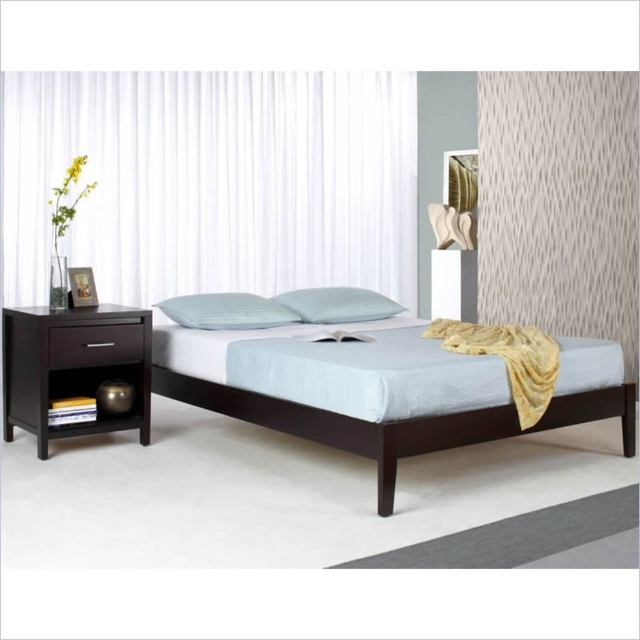
Question: Can you confirm if white sheer curtain at upper left is positioned to the left of light blue fabric pillow at center?

Choices:
 (A) yes
 (B) no

Answer: (A)

Question: Which of the following is the closest to the observer?

Choices:
 (A) (22, 83)
 (B) (52, 348)
 (C) (324, 292)
 (D) (29, 339)

Answer: (B)

Question: Among these points, which one is nearest to the camera?

Choices:
 (A) (243, 211)
 (B) (170, 316)

Answer: (B)

Question: Can you confirm if white quilted pillow at center is positioned below dark wood drawer at left?

Choices:
 (A) no
 (B) yes

Answer: (A)

Question: Which object is closer to the camera taking this photo?

Choices:
 (A) white textured curtain at upper right
 (B) dark wood nightstand at left

Answer: (B)

Question: Is dark wood bed at center thinner than light blue fabric pillow at center?

Choices:
 (A) yes
 (B) no

Answer: (B)